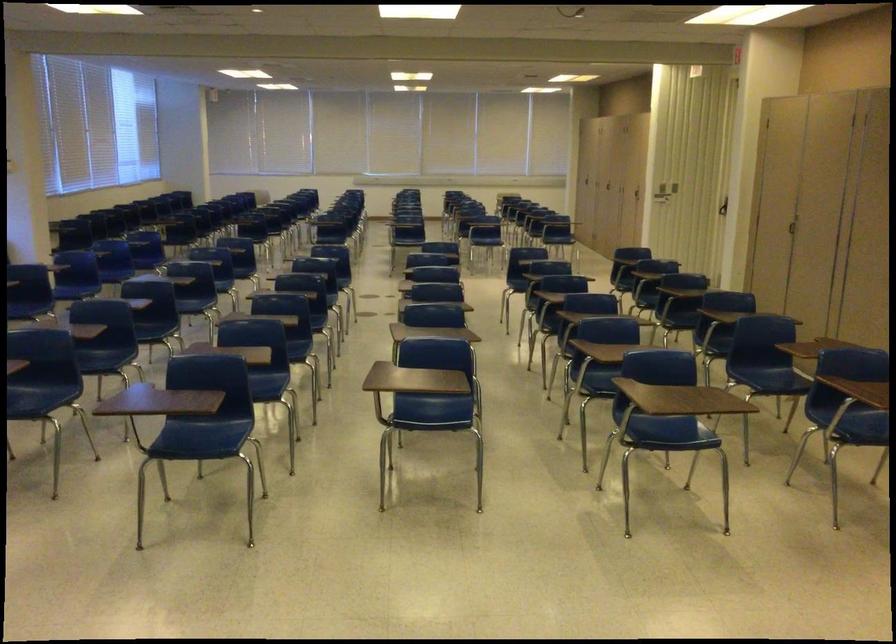
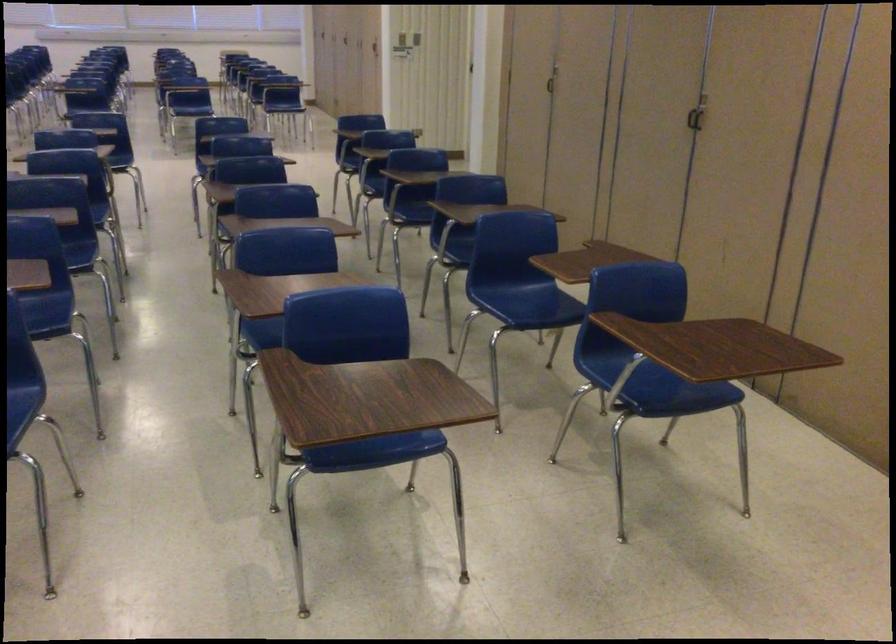
Which direction would the cameraman need to move to produce the second image?

The cameraman moved toward right, forward.